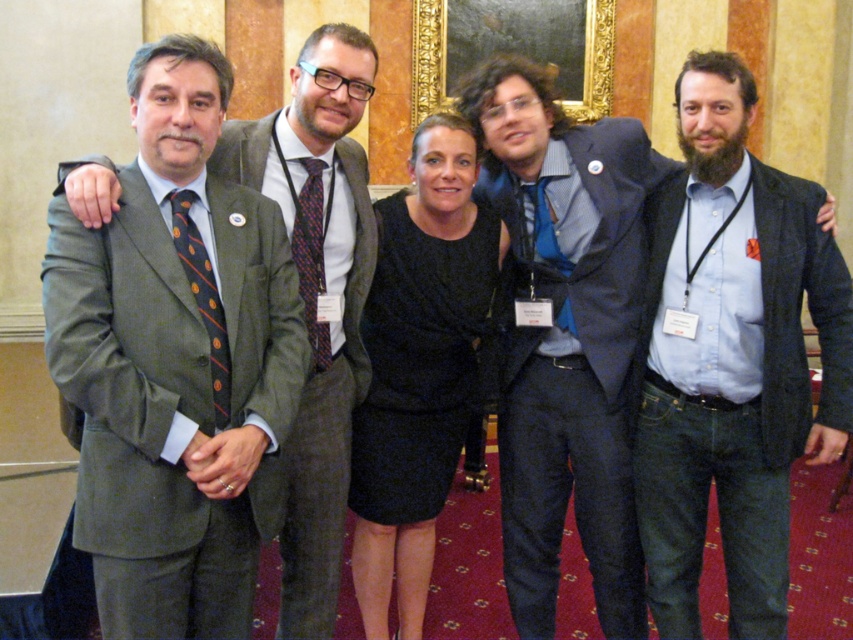
Question: Which point is farther to the camera?

Choices:
 (A) matte gray suit at center
 (B) black satin dress at center
 (C) patterned silk tie at center
 (D) matte green suit at left

Answer: (B)

Question: Is matte gray suit at center below blue denim jeans at right?

Choices:
 (A) no
 (B) yes

Answer: (A)

Question: Which point is closer to the camera taking this photo?

Choices:
 (A) (189, 241)
 (B) (302, 125)
 (C) (436, 467)
 (D) (631, 397)

Answer: (A)

Question: Which object appears farthest from the camera in this image?

Choices:
 (A) patterned silk tie at center
 (B) matte gray suit at center
 (C) black satin dress at center
 (D) blue denim jeans at right

Answer: (C)

Question: Does blue denim jeans at right have a smaller size compared to green striped tie at left?

Choices:
 (A) no
 (B) yes

Answer: (A)

Question: Does matte gray suit at center appear over dark blue textured suit at center?

Choices:
 (A) yes
 (B) no

Answer: (A)